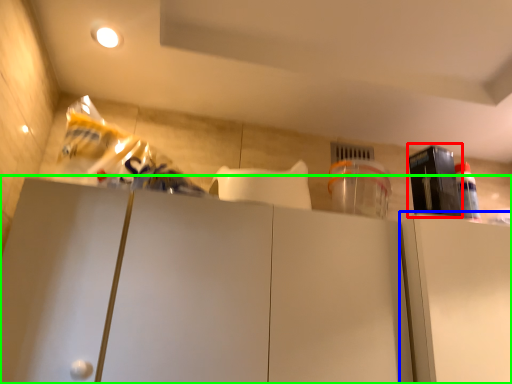
Question: Estimate the real-world distances between objects in this image. Which object is closer to appliance (highlighted by a red box), cabinetry (highlighted by a blue box) or cabinetry (highlighted by a green box)?

Choices:
 (A) cabinetry
 (B) cabinetry

Answer: (A)